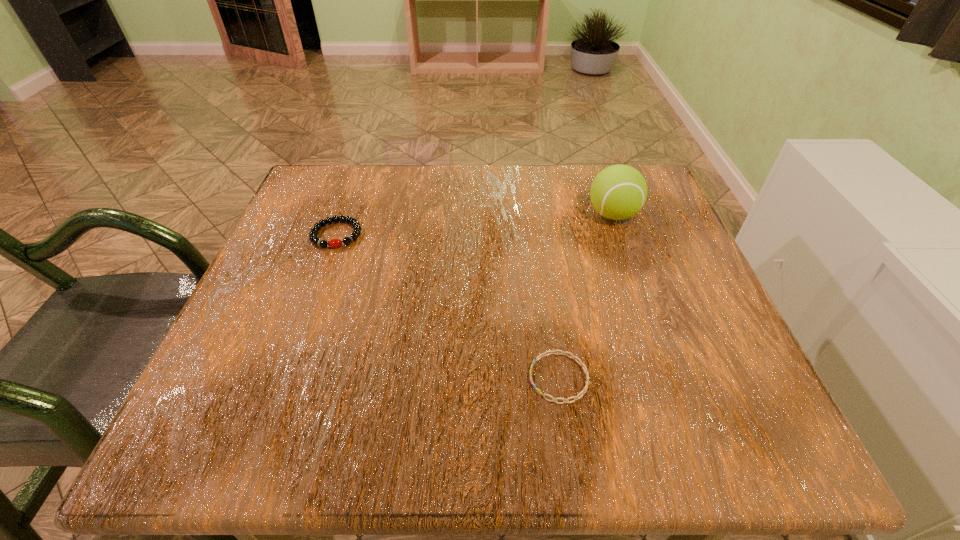
Locate an element on the screen. The width and height of the screenshot is (960, 540). vacant space at the left edge is located at coordinates (307, 320).

In the image, there is a desktop. Identify the location of vacant space at the right edge. The height and width of the screenshot is (540, 960). (638, 276).

Find the location of a particular element. The image size is (960, 540). free spot at the near left corner of the desktop is located at coordinates (214, 413).

In order to click on vacant point at the far right corner in this screenshot , I will do `click(642, 173)`.

You are a GUI agent. You are given a task and a screenshot of the screen. Output one action in this format:
    pyautogui.click(x=<x>, y=<y>)
    Task: Click on the vacant space at the near right corner of the desktop
    
    Given the screenshot: What is the action you would take?
    tap(698, 433)

Locate an element on the screen. This screenshot has width=960, height=540. vacant space that is in between the tallest object and the leftmost object is located at coordinates (475, 225).

Locate an element on the screen. This screenshot has height=540, width=960. free space between the leftmost object and the nearer bracelet is located at coordinates (448, 306).

Where is `empty space between the shortest object and the tennis ball`? The width and height of the screenshot is (960, 540). empty space between the shortest object and the tennis ball is located at coordinates (586, 296).

Where is `vacant space that's between the tennis ball and the shortest object`? vacant space that's between the tennis ball and the shortest object is located at coordinates 586,296.

Locate an element on the screen. free area in between the rightmost object and the right bracelet is located at coordinates (586, 296).